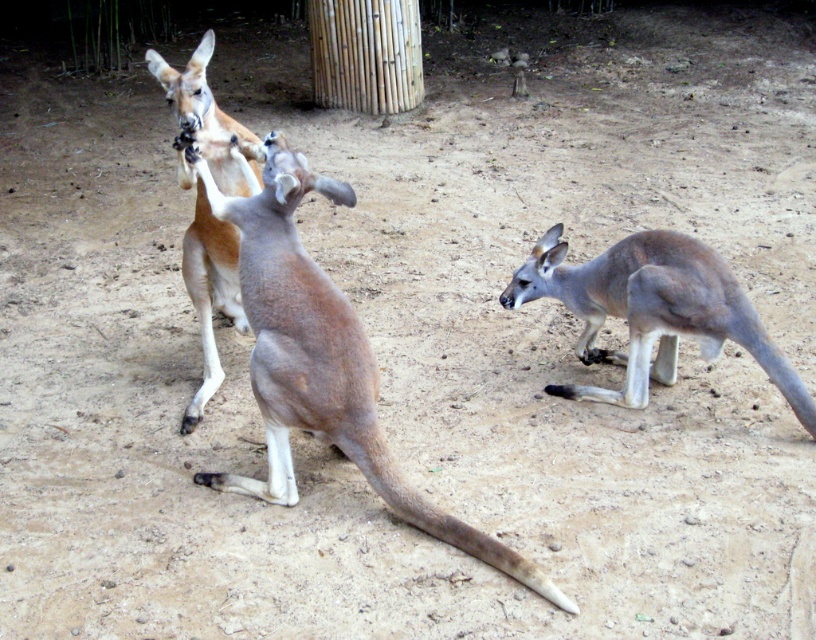
Based on the photo, you are standing in front of the kangaroo enclosure at the zoo. There is a specific point marked at coordinates point (344, 381). If you want to throw a small treat to that point, will it land within the enclosure? Please explain your reasoning.

The point (344, 381) is 2.67 meters from the viewer. Since the enclosure is designed to contain the kangaroos and the point is within the visible area, the treat would land within the enclosure.